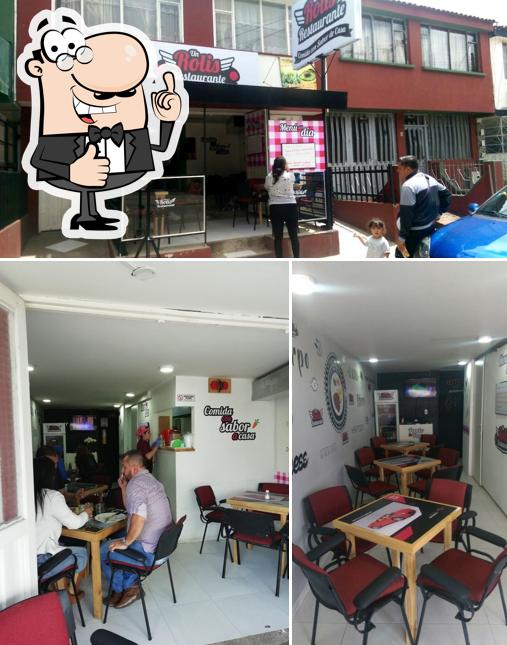
Image resolution: width=507 pixels, height=645 pixels. What are the coordinates of `place to eat food` in the screenshot? It's located at (411, 510).